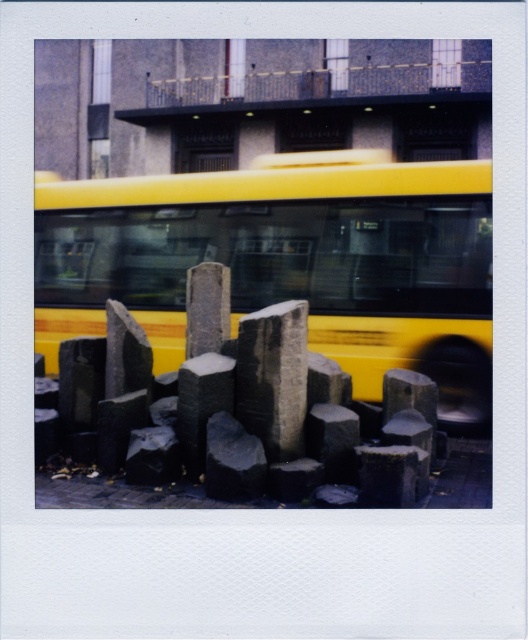
Question: Is yellow matte bus at center above dark gray stone at center?

Choices:
 (A) no
 (B) yes

Answer: (B)

Question: Which of the following is the closest to the observer?

Choices:
 (A) (257, 330)
 (B) (335, 438)
 (C) (89, 257)

Answer: (A)

Question: Which object appears farthest from the camera in this image?

Choices:
 (A) dark gray stone boulder at center
 (B) dark gray stone at center
 (C) yellow matte bus at center

Answer: (C)

Question: Which object is closer to the camera taking this photo?

Choices:
 (A) dark gray stone at center
 (B) dark gray stone boulder at center
 (C) yellow matte bus at center

Answer: (A)

Question: Does yellow matte bus at center appear under dark gray stone at center?

Choices:
 (A) yes
 (B) no

Answer: (B)

Question: Does yellow matte bus at center appear under dark gray stone boulder at center?

Choices:
 (A) no
 (B) yes

Answer: (A)